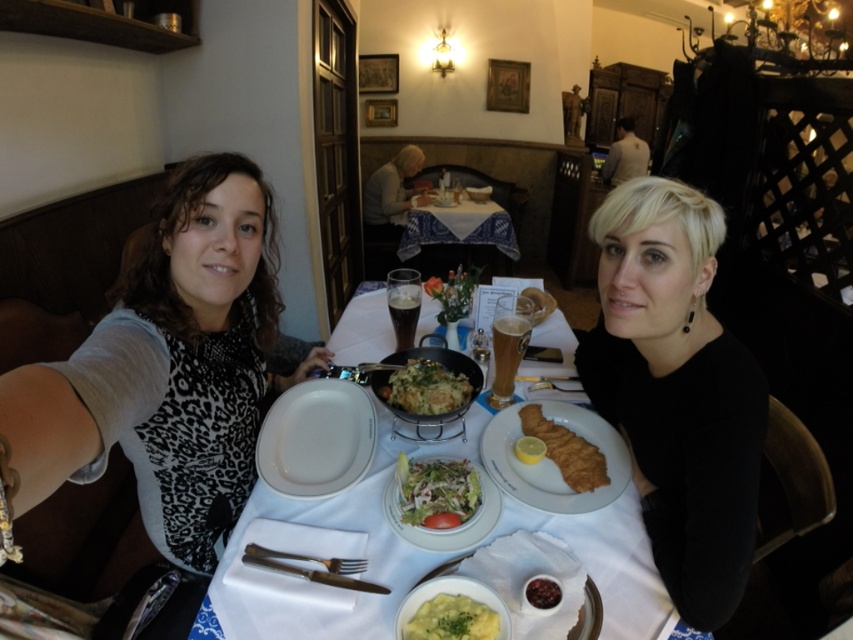
Question: Which of the following is the farthest from the observer?

Choices:
 (A) (396, 301)
 (B) (289, 452)
 (C) (396, 472)

Answer: (A)

Question: Is white glossy plate at center positioned behind smooth creamy mashed potatoes at center?

Choices:
 (A) yes
 (B) no

Answer: (A)

Question: Is the position of white fabric table at center less distant than that of green leafy vegetables at center?

Choices:
 (A) yes
 (B) no

Answer: (B)

Question: Which is farther from the white fabric table at center?

Choices:
 (A) white porcelain plates at center
 (B) translucent glass beer at center
 (C) smooth creamy mashed potatoes at center

Answer: (C)

Question: Which object appears closest to the camera in this image?

Choices:
 (A) white glossy plate at center
 (B) fresh green salad at center
 (C) dark glass at center
 (D) black matte shirt at center

Answer: (D)

Question: Where is white porcelain plates at center located in relation to white fabric table at center in the image?

Choices:
 (A) left
 (B) right

Answer: (A)